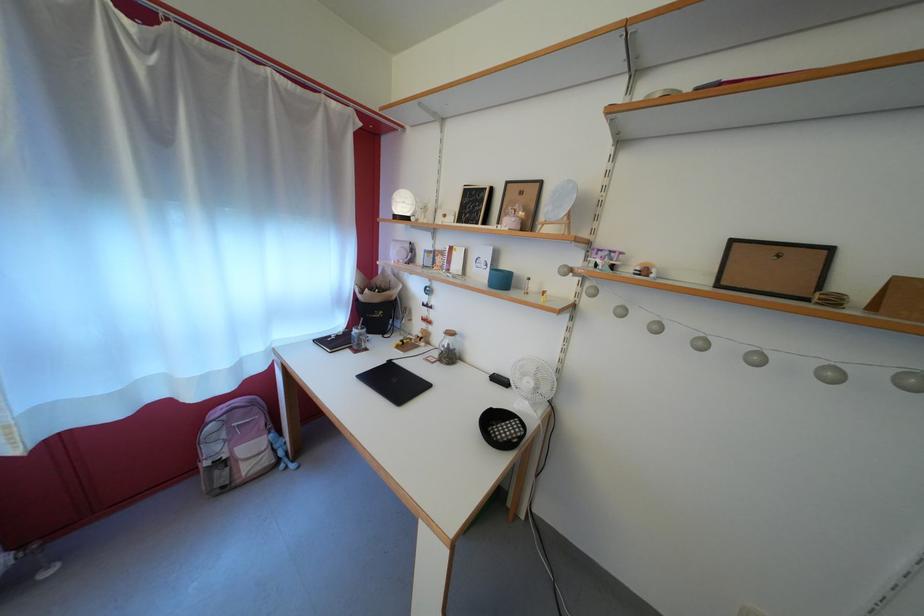
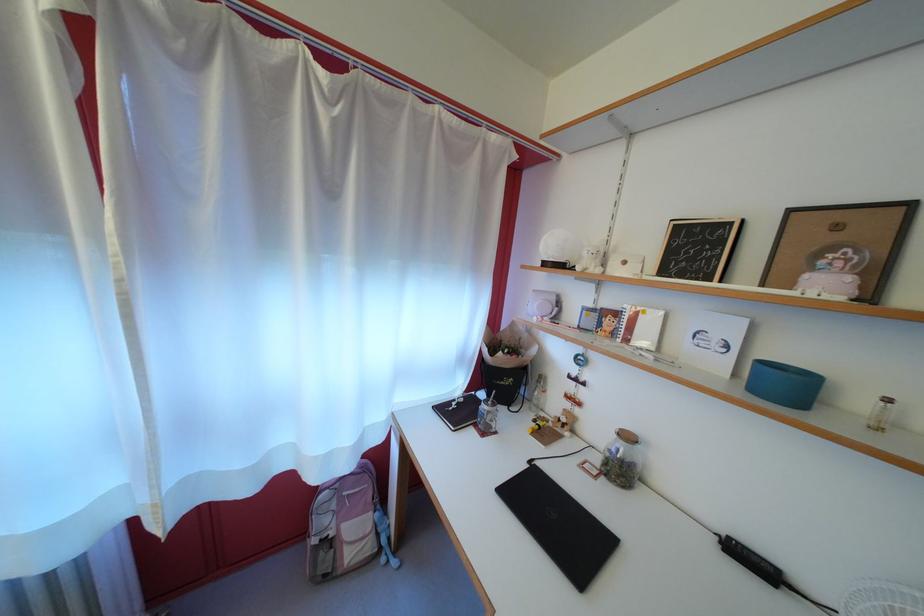
Where in the second image is the point corresponding to point 359,354 from the first image?

(483, 431)